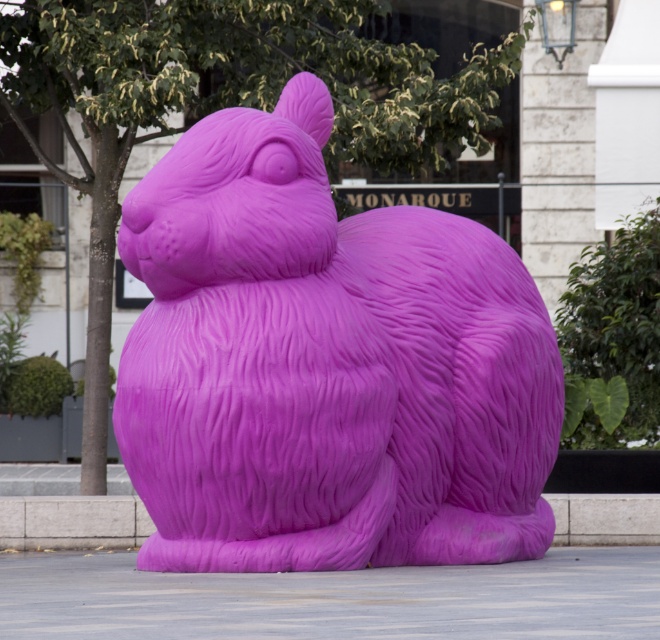
Question: Which of the following is the closest to the observer?

Choices:
 (A) (133, 566)
 (B) (583, 528)

Answer: (A)

Question: Considering the relative positions of gray concrete pavement at center and purple rubber curb at lower center in the image provided, where is gray concrete pavement at center located with respect to purple rubber curb at lower center?

Choices:
 (A) left
 (B) right

Answer: (B)

Question: Which of the following is the farthest from the observer?

Choices:
 (A) (315, 605)
 (B) (79, 500)

Answer: (B)

Question: Is matte purple rabbit at center positioned in front of gray concrete pavement at center?

Choices:
 (A) yes
 (B) no

Answer: (B)

Question: Which of the following is the closest to the observer?

Choices:
 (A) (517, 588)
 (B) (99, 531)

Answer: (A)

Question: Observing the image, what is the correct spatial positioning of gray concrete pavement at center in reference to purple rubber curb at lower center?

Choices:
 (A) right
 (B) left

Answer: (A)